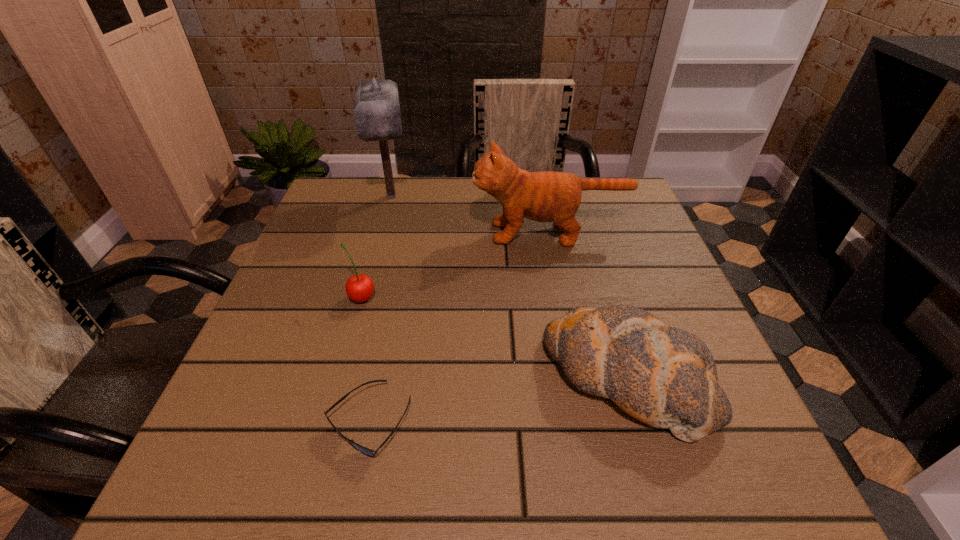
Where is `cat at the right edge`? cat at the right edge is located at coordinates (548, 196).

Where is `bread that is at the right edge`? This screenshot has height=540, width=960. bread that is at the right edge is located at coordinates (663, 376).

At what (x,y) coordinates should I click in order to perform the action: click on object that is positioned at the far left corner. Please return your answer as a coordinate pair (x, y). The height and width of the screenshot is (540, 960). Looking at the image, I should click on (376, 109).

Locate an element on the screen. The image size is (960, 540). object positioned at the far right corner is located at coordinates (548, 196).

Locate an element on the screen. This screenshot has width=960, height=540. object situated at the near right corner is located at coordinates (663, 376).

At what (x,y) coordinates should I click in order to perform the action: click on free space at the far edge of the desktop. Please return your answer as a coordinate pair (x, y). The image size is (960, 540). Looking at the image, I should click on (383, 217).

In the image, there is a desktop. Where is `free space at the near edge`? free space at the near edge is located at coordinates (582, 447).

You are a GUI agent. You are given a task and a screenshot of the screen. Output one action in this format:
    pyautogui.click(x=<x>, y=<y>)
    Task: Click on the vacant space at the left edge of the desktop
    
    Given the screenshot: What is the action you would take?
    (x=318, y=279)

The height and width of the screenshot is (540, 960). I want to click on vacant space at the right edge of the desktop, so click(709, 341).

Identify the location of vacant space at the far left corner of the desktop. This screenshot has height=540, width=960. (375, 225).